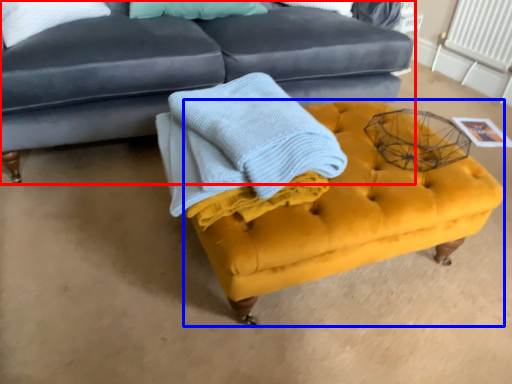
Question: Which object is further to the camera taking this photo, studio couch (highlighted by a red box) or swivel chair (highlighted by a blue box)?

Choices:
 (A) studio couch
 (B) swivel chair

Answer: (A)